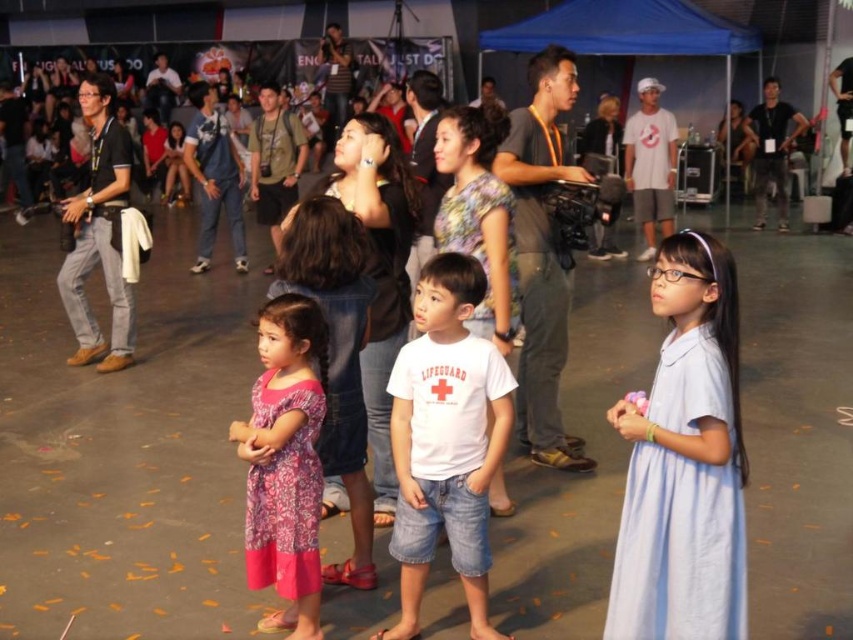
Based on the photo, who is positioned more to the left, light blue fabric dress at center or white cotton t-shirt at center?

white cotton t-shirt at center is more to the left.

Is the position of light blue fabric dress at center more distant than that of white cotton t-shirt at center?

No, light blue fabric dress at center is in front of white cotton t-shirt at center.

Who is more forward, (x=619, y=605) or (x=433, y=522)?

Positioned in front is point (x=619, y=605).

Locate an element on the screen. The width and height of the screenshot is (853, 640). light blue fabric dress at center is located at coordinates (683, 461).

How much distance is there between light blue fabric dress at center and pink floral dress at center?

light blue fabric dress at center is 3.84 feet away from pink floral dress at center.

Does light blue fabric dress at center appear on the right side of pink floral dress at center?

Correct, you'll find light blue fabric dress at center to the right of pink floral dress at center.

Who is more forward, (740, 433) or (317, 493)?

Point (740, 433)

At what (x,y) coordinates should I click in order to perform the action: click on light blue fabric dress at center. Please return your answer as a coordinate pair (x, y). The image size is (853, 640). Looking at the image, I should click on (683, 461).

Is white cotton t-shirt at center further to camera compared to pink floral dress at center?

Yes.

Locate an element on the screen. This screenshot has width=853, height=640. white cotton t-shirt at center is located at coordinates (445, 440).

Which is behind, point (450, 492) or point (263, 355)?

The point (450, 492) is behind.

Where is `white cotton t-shirt at center`? The width and height of the screenshot is (853, 640). white cotton t-shirt at center is located at coordinates (445, 440).